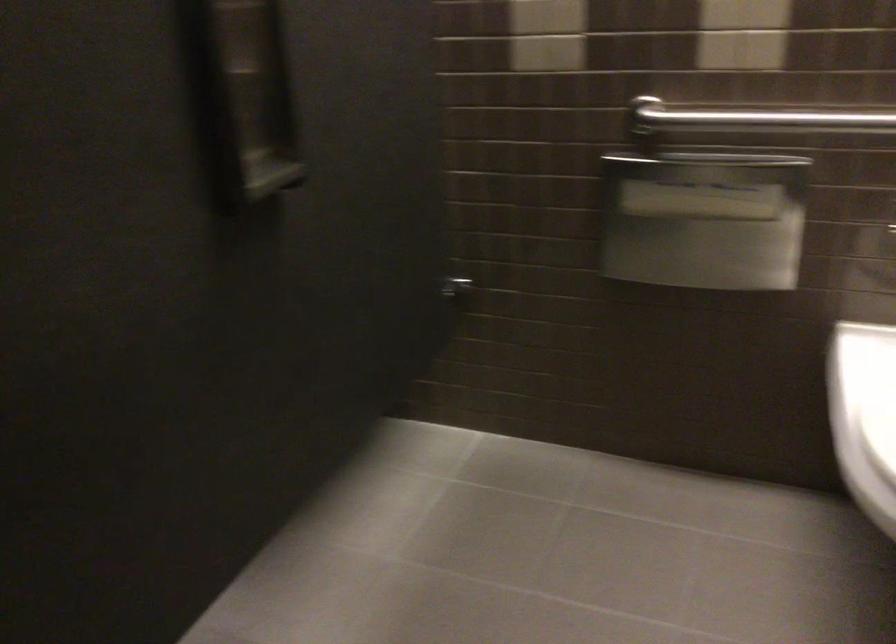
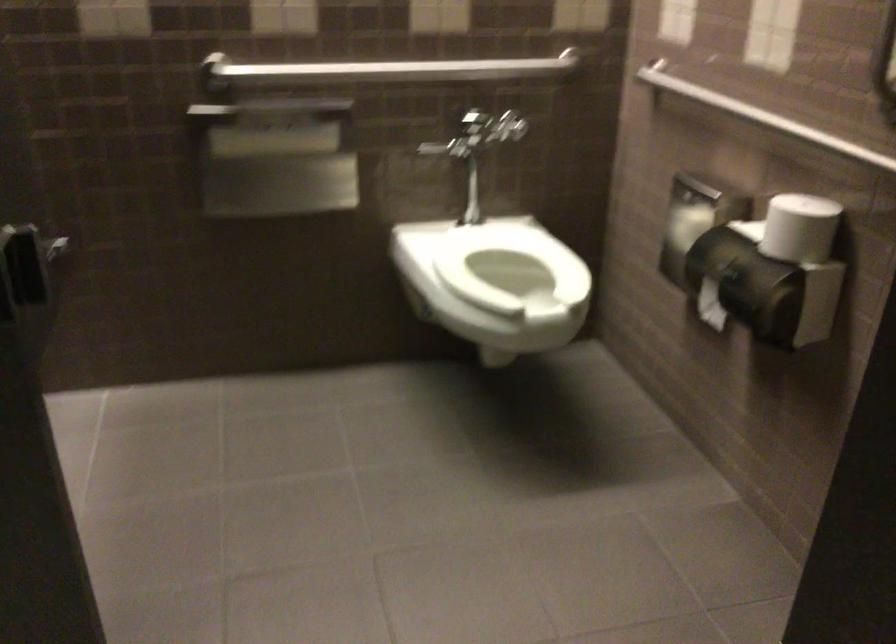
Locate, in the second image, the point that corresponds to point (407, 263) in the first image.

(26, 223)